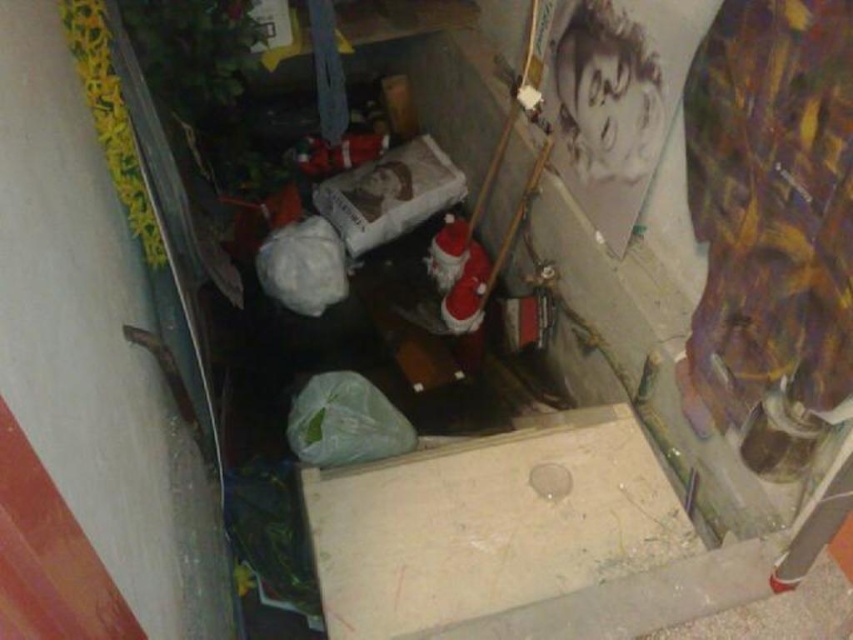
Question: Which point is closer to the camera taking this photo?

Choices:
 (A) (534, 486)
 (B) (306, 273)

Answer: (A)

Question: Which is nearer to the transparent plastic hole at center?

Choices:
 (A) green plastic bag at center
 (B) white matte plastic bag at center

Answer: (A)

Question: Observing the image, what is the correct spatial positioning of green plastic bag at center in reference to white matte plastic bag at center?

Choices:
 (A) left
 (B) right

Answer: (B)

Question: Which of the following is the closest to the observer?

Choices:
 (A) (532, 488)
 (B) (335, 451)

Answer: (A)

Question: Considering the relative positions of green plastic bag at center and white matte plastic bag at center in the image provided, where is green plastic bag at center located with respect to white matte plastic bag at center?

Choices:
 (A) left
 (B) right

Answer: (B)

Question: Where is green plastic bag at center located in relation to transparent plastic hole at center in the image?

Choices:
 (A) right
 (B) left

Answer: (B)